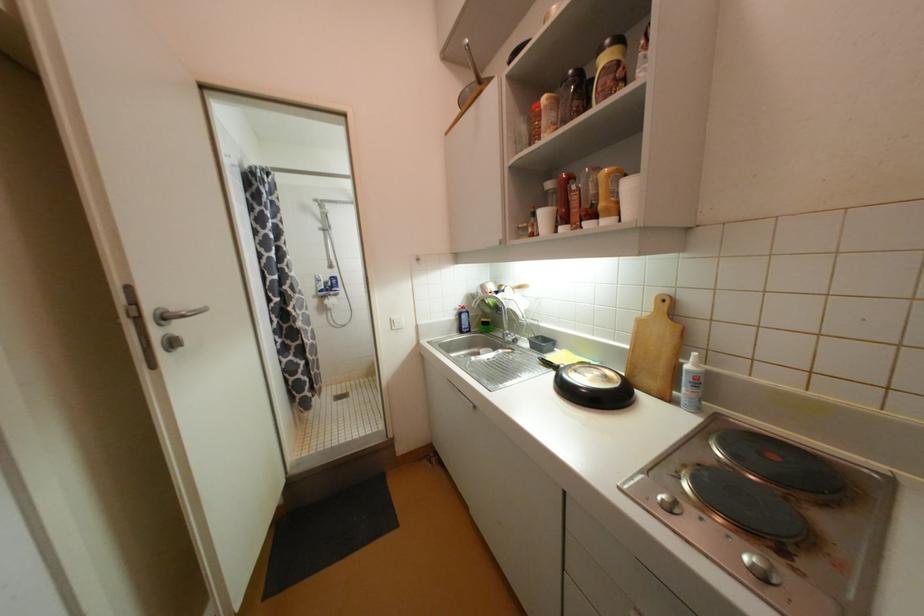
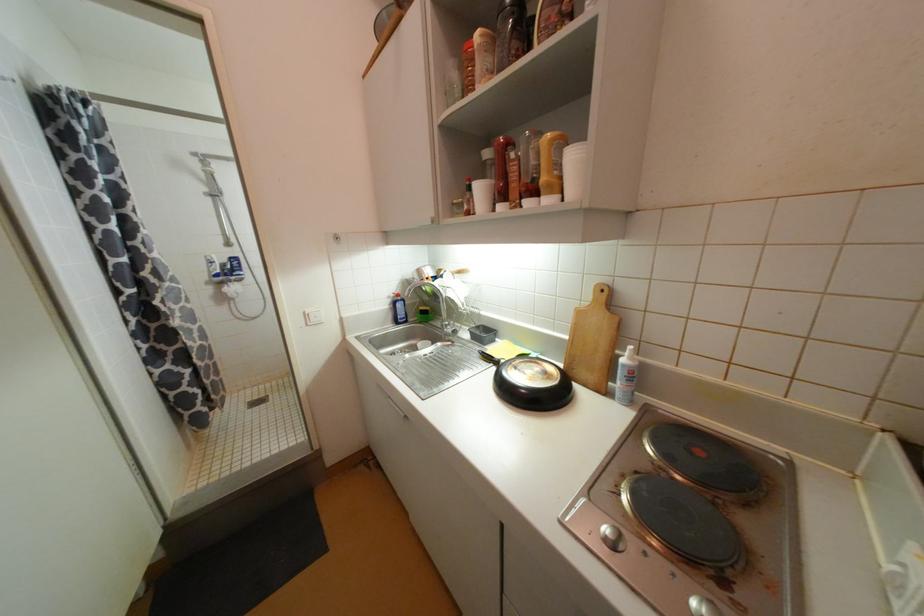
Question: The images are taken continuously from a first-person perspective. In which direction is your viewpoint rotating?

Choices:
 (A) Left
 (B) Right
 (C) Up
 (D) Down

Answer: (B)